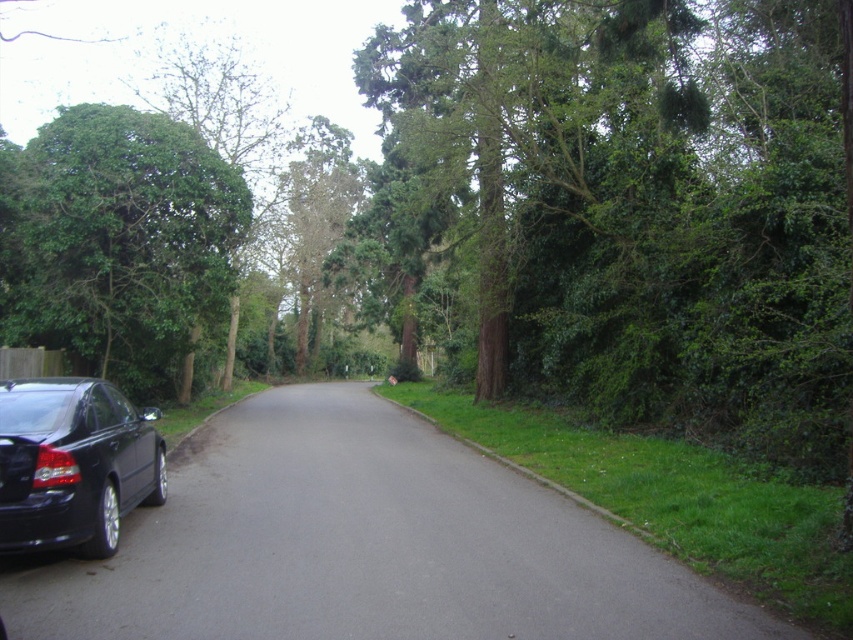
Question: Does black asphalt driveway at lower left have a lesser width compared to glossy black car at lower left?

Choices:
 (A) yes
 (B) no

Answer: (B)

Question: Does black asphalt driveway at lower left appear over green leafy tree at left?

Choices:
 (A) no
 (B) yes

Answer: (A)

Question: Is black asphalt driveway at lower left behind glossy black car at lower left?

Choices:
 (A) no
 (B) yes

Answer: (A)

Question: Which point is farther from the camera taking this photo?

Choices:
 (A) (132, 436)
 (B) (276, 580)
 (C) (189, 250)

Answer: (C)

Question: Based on their relative distances, which object is farther from the black asphalt driveway at lower left?

Choices:
 (A) glossy black car at lower left
 (B) green leafy tree at left

Answer: (B)

Question: Which object is positioned farthest from the black asphalt driveway at lower left?

Choices:
 (A) green leafy tree at left
 (B) glossy black car at lower left

Answer: (A)